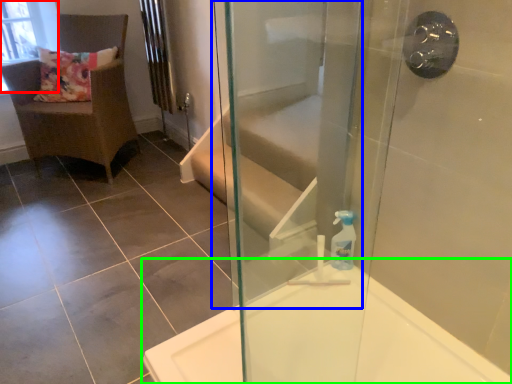
Question: Estimate the real-world distances between objects in this image. Which object is closer to window screen (highlighted by a red box), screen door (highlighted by a blue box) or bathtub (highlighted by a green box)?

Choices:
 (A) screen door
 (B) bathtub

Answer: (A)